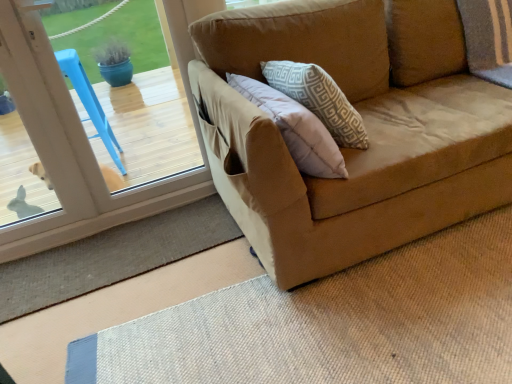
Question: From the image's perspective, does burlap mat at lower left appear higher than transparent glass door at left?

Choices:
 (A) yes
 (B) no

Answer: (B)

Question: Does burlap mat at lower left have a lesser height compared to transparent glass door at left?

Choices:
 (A) no
 (B) yes

Answer: (B)

Question: Is burlap mat at lower left wider than transparent glass door at left?

Choices:
 (A) yes
 (B) no

Answer: (A)

Question: Is burlap mat at lower left further to the viewer compared to transparent glass door at left?

Choices:
 (A) no
 (B) yes

Answer: (B)

Question: Is the depth of burlap mat at lower left less than that of transparent glass door at left?

Choices:
 (A) no
 (B) yes

Answer: (A)

Question: Is burlap mat at lower left in contact with transparent glass door at left?

Choices:
 (A) no
 (B) yes

Answer: (A)

Question: Is transparent glass door at left in contact with burlap mat at lower left?

Choices:
 (A) no
 (B) yes

Answer: (A)

Question: From a real-world perspective, is transparent glass door at left located higher than burlap mat at lower left?

Choices:
 (A) yes
 (B) no

Answer: (A)

Question: From the image's perspective, is transparent glass door at left below burlap mat at lower left?

Choices:
 (A) no
 (B) yes

Answer: (A)

Question: Does transparent glass door at left have a greater height compared to burlap mat at lower left?

Choices:
 (A) no
 (B) yes

Answer: (B)

Question: Would you consider transparent glass door at left to be distant from burlap mat at lower left?

Choices:
 (A) no
 (B) yes

Answer: (A)

Question: From a real-world perspective, is transparent glass door at left positioned under burlap mat at lower left based on gravity?

Choices:
 (A) yes
 (B) no

Answer: (B)

Question: From a real-world perspective, is transparent glass door at left physically located above or below burlap mat at lower left?

Choices:
 (A) below
 (B) above

Answer: (B)